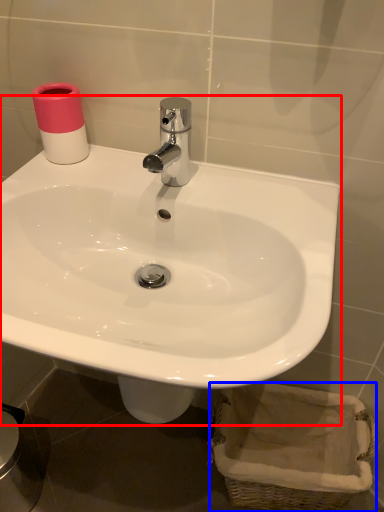
Question: Which object is closer to the camera taking this photo, sink (highlighted by a red box) or basket (highlighted by a blue box)?

Choices:
 (A) sink
 (B) basket

Answer: (A)